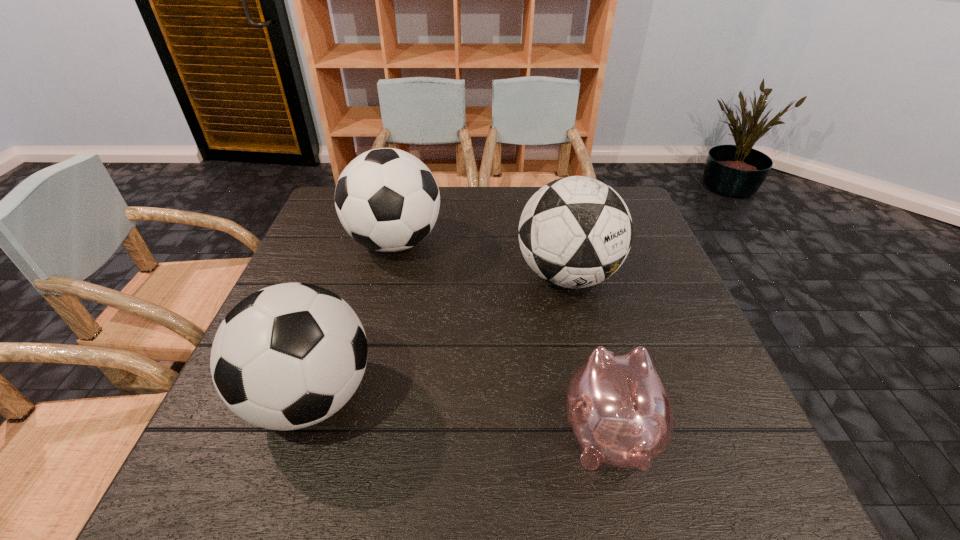
The height and width of the screenshot is (540, 960). I want to click on piggy bank positioned at the near edge, so click(619, 409).

You are a GUI agent. You are given a task and a screenshot of the screen. Output one action in this format:
    pyautogui.click(x=<x>, y=<y>)
    Task: Click on the object present at the right edge
    This screenshot has height=540, width=960.
    Given the screenshot: What is the action you would take?
    pyautogui.click(x=574, y=232)

The height and width of the screenshot is (540, 960). In order to click on object at the far left corner in this screenshot , I will do `click(387, 200)`.

Find the location of a particular element. The height and width of the screenshot is (540, 960). object that is positioned at the near left corner is located at coordinates (288, 356).

Where is `free location at the far edge of the desktop`? Image resolution: width=960 pixels, height=540 pixels. free location at the far edge of the desktop is located at coordinates (497, 202).

Find the location of a particular element. vacant space at the left edge of the desktop is located at coordinates (312, 264).

Locate an element on the screen. This screenshot has width=960, height=540. blank space at the right edge of the desktop is located at coordinates (716, 414).

You are a GUI agent. You are given a task and a screenshot of the screen. Output one action in this format:
    pyautogui.click(x=<x>, y=<y>)
    Task: Click on the blank area at the far right corner
    This screenshot has width=960, height=540.
    Given the screenshot: What is the action you would take?
    pyautogui.click(x=634, y=205)

This screenshot has height=540, width=960. I want to click on free spot at the near right corner of the desktop, so pyautogui.click(x=670, y=458).

Identify the location of free space between the shortest object and the nearest soccer ball. (460, 414).